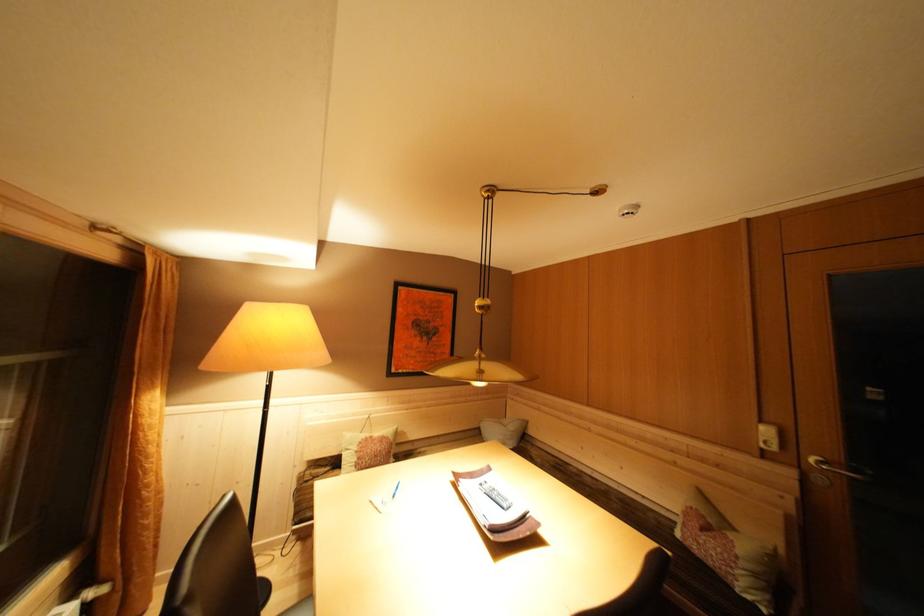
Describe the element at coordinates (768, 437) in the screenshot. Image resolution: width=924 pixels, height=616 pixels. I see `the white power outlet` at that location.